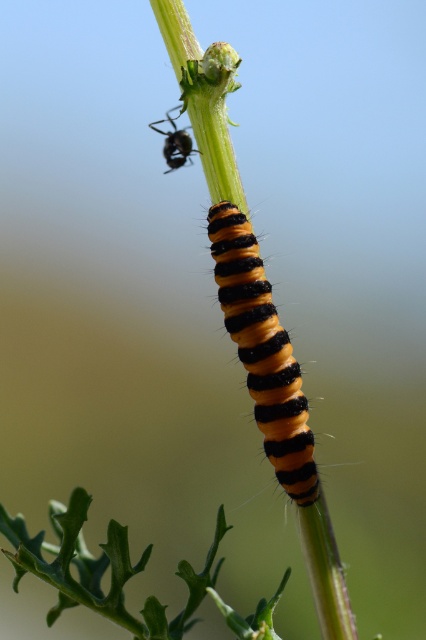
You are a photographer trying to capture a detailed shot of the orange fuzzy caterpillar at center and the shiny black ant at upper center. Since the background is blurred, which subject should you focus on to ensure the closest one is sharp?

The orange fuzzy caterpillar at center is closer to the viewer than the shiny black ant at upper center, so focusing on it will ensure the closest subject is sharp.

You are a photographer trying to capture a closeup of the orange fuzzy caterpillar at center and the shiny black ant at upper center. Which one would appear larger in your photo if you focus on the caterpillar?

The orange fuzzy caterpillar at center would appear larger in the photo because it is taller than the shiny black ant at upper center.

You are a photographer trying to capture a closeup of the orange fuzzy caterpillar at center and the shiny black ant at upper center. Which subject should you focus on if you want the one that is wider to be in sharp focus?

The orange fuzzy caterpillar at center is wider than the shiny black ant at upper center, so you should focus on the orange fuzzy caterpillar at center to ensure it is in sharp focus.